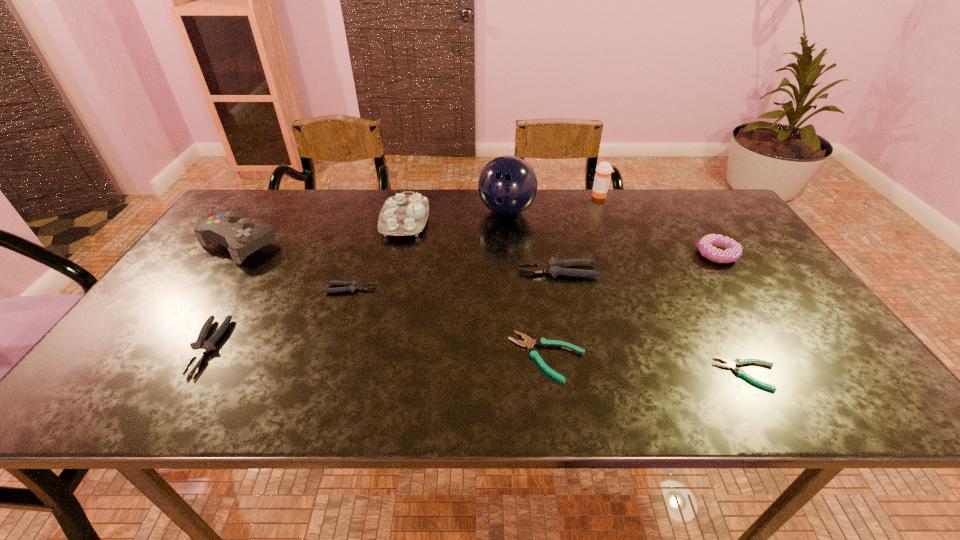
The width and height of the screenshot is (960, 540). I want to click on free space at the near edge of the desktop, so click(x=614, y=382).

Where is `vacant space at the left edge of the desktop`? This screenshot has height=540, width=960. vacant space at the left edge of the desktop is located at coordinates click(180, 275).

Where is `vacant space at the right edge of the desktop`? This screenshot has width=960, height=540. vacant space at the right edge of the desktop is located at coordinates (786, 315).

You are a GUI agent. You are given a task and a screenshot of the screen. Output one action in this format:
    pyautogui.click(x=<x>, y=<y>)
    Task: Click on the free space at the far left corner
    This screenshot has width=960, height=540.
    Given the screenshot: What is the action you would take?
    pyautogui.click(x=257, y=218)

You are a GUI agent. You are given a task and a screenshot of the screen. Output one action in this format:
    pyautogui.click(x=<x>, y=<y>)
    Task: Click on the vacant area at the near right corner of the desktop
    This screenshot has height=540, width=960.
    Given the screenshot: What is the action you would take?
    [x=833, y=397]

The height and width of the screenshot is (540, 960). I want to click on blank region between the chinaware and the fourth nearest object, so click(x=378, y=254).

This screenshot has height=540, width=960. I want to click on empty space between the fifth tallest object and the nearest gray pliers, so click(x=462, y=300).

Locate an element on the screen. The width and height of the screenshot is (960, 540). vacant area that lies between the shortest object and the control is located at coordinates (493, 309).

Image resolution: width=960 pixels, height=540 pixels. I want to click on free space between the orange medicine and the second nearest gray pliers, so click(x=475, y=242).

This screenshot has height=540, width=960. Identify the location of vacant point located between the control and the smaller teal pliers. (493, 309).